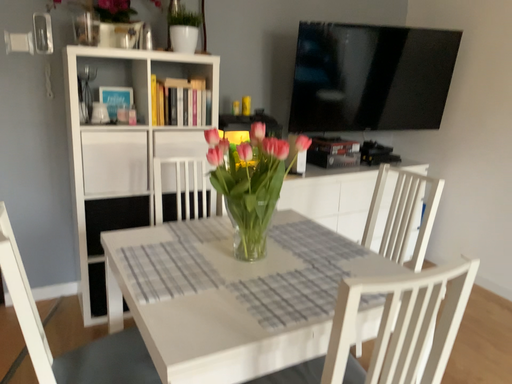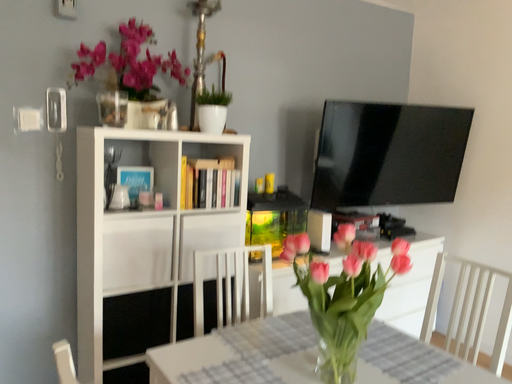
Question: How did the camera likely rotate when shooting the video?

Choices:
 (A) rotated downward
 (B) rotated upward

Answer: (B)